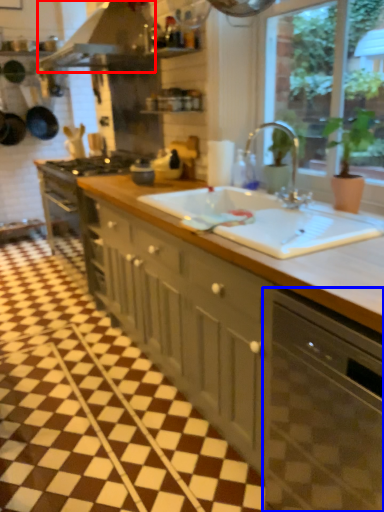
Question: Which object is further to the camera taking this photo, exhaust hood (highlighted by a red box) or dish washer (highlighted by a blue box)?

Choices:
 (A) exhaust hood
 (B) dish washer

Answer: (A)